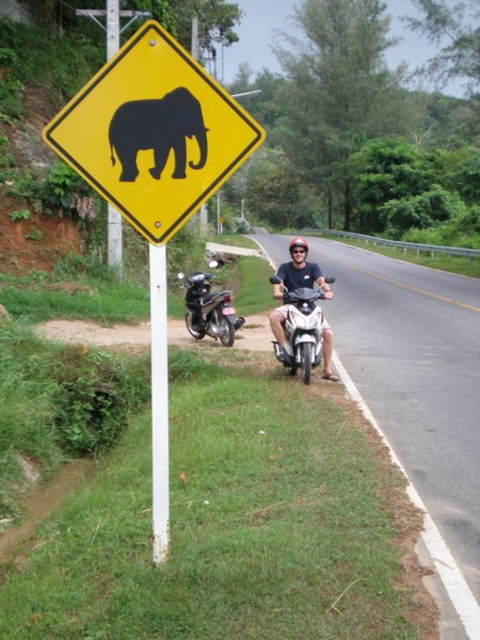
You are a delivery driver approaching the asphalt road at center and need to pass by the yellow plastic elephant at upper left. Which object will you encounter first?

The asphalt road at center is in front of the yellow plastic elephant at upper left, so you will encounter the asphalt road at center first before reaching the yellow plastic elephant at upper left.

You are a delivery driver who needs to park your scooter on the road. The parking area is marked by the point at coordinates (300,328). Is the silver metallic scooter at center currently occupying the parking spot?

The point at coordinates (300,328) indicates the silver metallic scooter at center, so yes, the silver metallic scooter at center is occupying the parking spot at that location.

You are a delivery driver who needs to park your scooter safely away from the road. You see the white metal pole at center and the metallic silver scooter at lower left. Which object is closer to the road edge, and should you park your scooter there?

The metallic silver scooter at lower left is closer to the road edge. However, since the white metal pole at center is to the right of the metallic silver scooter at lower left, parking near the white metal pole at center would be safer as it is further from the road edge.